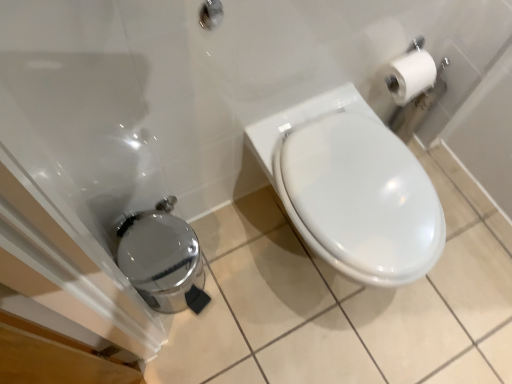
At what (x,y) coordinates should I click in order to perform the action: click on polished stainless steel trash can at lower left. Please return your answer as a coordinate pair (x, y). Looking at the image, I should click on [x=162, y=259].

What do you see at coordinates (352, 188) in the screenshot? This screenshot has height=384, width=512. I see `white glossy toilet at center` at bounding box center [352, 188].

Measure the distance between point (290, 163) and camera.

The depth of point (290, 163) is 3.33 feet.

Describe the element at coordinates (211, 14) in the screenshot. The height and width of the screenshot is (384, 512). I see `brushed metal showerhead at upper center` at that location.

Where is `polished stainless steel trash can at lower left`? polished stainless steel trash can at lower left is located at coordinates (162, 259).

From the image's perspective, is white glossy toilet at center located above polished stainless steel trash can at lower left?

Yes.

Is white glossy toilet at center placed right next to polished stainless steel trash can at lower left?

white glossy toilet at center is not next to polished stainless steel trash can at lower left, and they're not touching.

Can you confirm if white glossy toilet at center is positioned to the right of polished stainless steel trash can at lower left?

Yes, white glossy toilet at center is to the right of polished stainless steel trash can at lower left.

From their relative heights in the image, would you say white glossy toilet at center is taller or shorter than polished stainless steel trash can at lower left?

white glossy toilet at center is taller than polished stainless steel trash can at lower left.

Considering the relative sizes of white glossy toilet at center and brushed metal showerhead at upper center in the image provided, is white glossy toilet at center thinner than brushed metal showerhead at upper center?

No.

Is point (280, 171) positioned after point (205, 15)?

Yes, point (280, 171) is behind point (205, 15).

Is white glossy toilet at center positioned before brushed metal showerhead at upper center?

That is False.

Choose the correct answer: Is white glossy toilet at center inside brushed metal showerhead at upper center or outside it?

white glossy toilet at center is located beyond the bounds of brushed metal showerhead at upper center.

Which object is positioned more to the left, polished stainless steel trash can at lower left or white glossy toilet at center?

polished stainless steel trash can at lower left is more to the left.

Between polished stainless steel trash can at lower left and white glossy toilet at center, which one has less height?

With less height is polished stainless steel trash can at lower left.

Is polished stainless steel trash can at lower left completely or partially outside of white glossy toilet at center?

Absolutely, polished stainless steel trash can at lower left is external to white glossy toilet at center.

From a real-world perspective, is polished stainless steel trash can at lower left positioned above or below white glossy toilet at center?

From a real-world perspective, polished stainless steel trash can at lower left is physically below white glossy toilet at center.

Between point (134, 213) and point (205, 22), which one is positioned in front?

The point (205, 22) is closer.

Consider the image. Which of these two, polished stainless steel trash can at lower left or brushed metal showerhead at upper center, is bigger?

polished stainless steel trash can at lower left.

From a real-world perspective, between polished stainless steel trash can at lower left and brushed metal showerhead at upper center, who is vertically higher?

brushed metal showerhead at upper center.

Is polished stainless steel trash can at lower left shorter than brushed metal showerhead at upper center?

Incorrect, the height of polished stainless steel trash can at lower left does not fall short of that of brushed metal showerhead at upper center.

Considering their positions, is brushed metal showerhead at upper center located in front of or behind polished stainless steel trash can at lower left?

Clearly, brushed metal showerhead at upper center is in front of polished stainless steel trash can at lower left.

In terms of size, does brushed metal showerhead at upper center appear bigger or smaller than polished stainless steel trash can at lower left?

In the image, brushed metal showerhead at upper center appears to be smaller than polished stainless steel trash can at lower left.

From the image's perspective, is brushed metal showerhead at upper center below polished stainless steel trash can at lower left?

No, from the image's perspective, brushed metal showerhead at upper center is not below polished stainless steel trash can at lower left.

Based on the photo, is brushed metal showerhead at upper center turned away from polished stainless steel trash can at lower left?

brushed metal showerhead at upper center does not have its back to polished stainless steel trash can at lower left.

Does point (207, 4) come behind point (346, 108)?

No.

In the image, is brushed metal showerhead at upper center positioned in front of or behind white glossy toilet at center?

In the image, brushed metal showerhead at upper center appears in front of white glossy toilet at center.

Is the surface of brushed metal showerhead at upper center in direct contact with white glossy toilet at center?

brushed metal showerhead at upper center and white glossy toilet at center are clearly separated.

In the scene shown: Is brushed metal showerhead at upper center smaller than white glossy toilet at center?

Yes, brushed metal showerhead at upper center is smaller than white glossy toilet at center.

The height and width of the screenshot is (384, 512). I want to click on toilet located in front of the polished stainless steel trash can at lower left, so click(x=352, y=188).

Identify the location of shower above the white glossy toilet at center (from the image's perspective). (211, 14).

When comparing their distances from white glossy toilet at center, does brushed metal showerhead at upper center or polished stainless steel trash can at lower left seem further?

The object further to white glossy toilet at center is brushed metal showerhead at upper center.

Estimate the real-world distances between objects in this image. Which object is further from polished stainless steel trash can at lower left, white glossy toilet at center or brushed metal showerhead at upper center?

Based on the image, brushed metal showerhead at upper center appears to be further to polished stainless steel trash can at lower left.

Which object lies nearer to the anchor point polished stainless steel trash can at lower left, brushed metal showerhead at upper center or white glossy toilet at center?

white glossy toilet at center is positioned closer to the anchor polished stainless steel trash can at lower left.

Looking at the image, which one is located closer to white glossy toilet at center, polished stainless steel trash can at lower left or brushed metal showerhead at upper center?

Among the two, polished stainless steel trash can at lower left is located nearer to white glossy toilet at center.

From the image, which object appears to be farther from brushed metal showerhead at upper center, white glossy toilet at center or polished stainless steel trash can at lower left?

polished stainless steel trash can at lower left is further to brushed metal showerhead at upper center.

Considering their positions, is polished stainless steel trash can at lower left positioned further to brushed metal showerhead at upper center than white glossy toilet at center?

Based on the image, polished stainless steel trash can at lower left appears to be further to brushed metal showerhead at upper center.

I want to click on toilet between brushed metal showerhead at upper center and polished stainless steel trash can at lower left in the vertical direction, so click(352, 188).